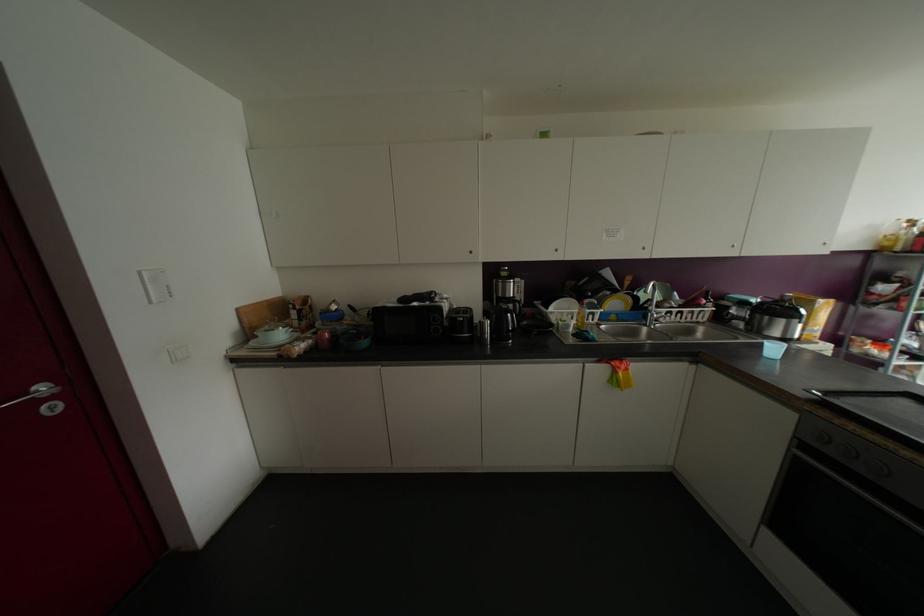
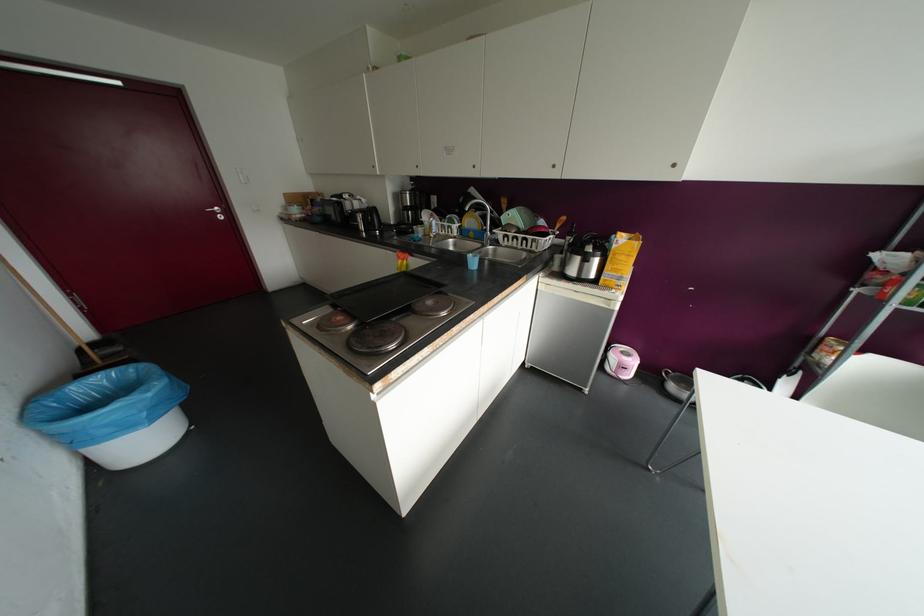
Where in the second image is the point corresponding to (x=37, y=402) from the first image?

(214, 213)